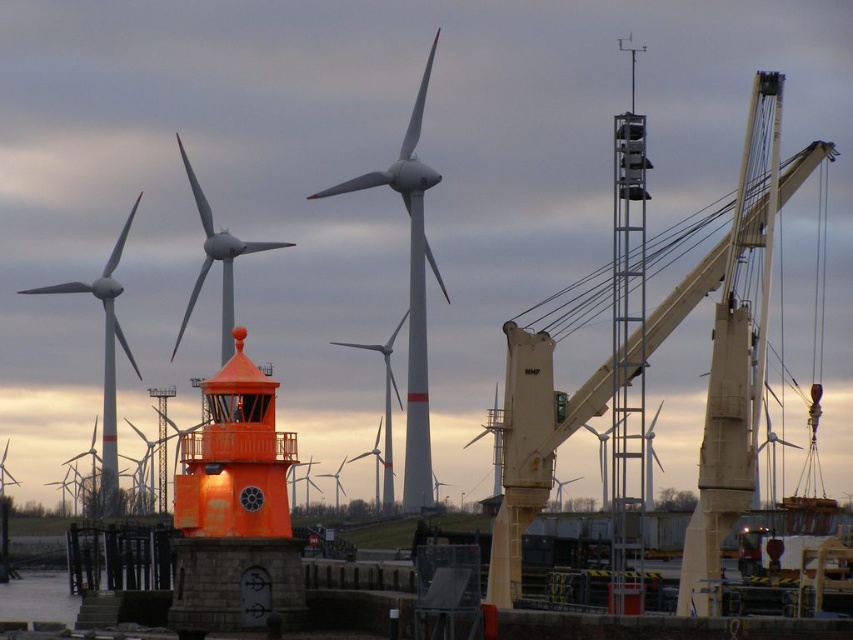
You are a delivery truck driver approaching the beige metallic crane at right and the white matte wind turbine at center. Which object will you see first as you drive towards them?

You will see the beige metallic crane at right first because it is positioned below the white matte wind turbine at center, meaning it is closer to your viewpoint.

You are a delivery drone that needs to fly from the white matte wind turbine at center to the white matte windmill at left. What is the minimum horizontal distance you must cover?

The minimum horizontal distance between the white matte wind turbine at center and the white matte windmill at left is 36.05 meters, so the drone must cover at least 36.05 meters.